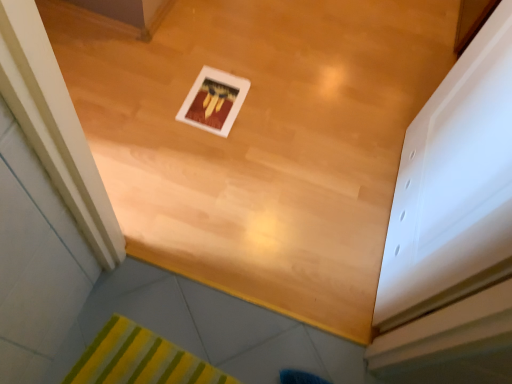
This screenshot has width=512, height=384. Identify the location of vacant space situated above white glossy picture frame at center (from a real-world perspective). (217, 99).